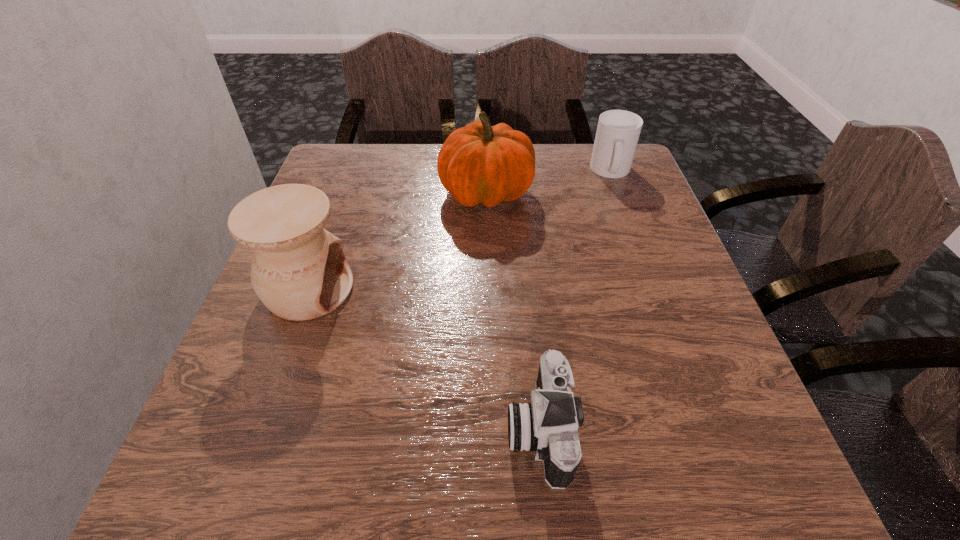
Identify the location of free region located on the back of the shortest object. (527, 305).

The image size is (960, 540). Find the location of `pumpkin that is at the far edge`. pumpkin that is at the far edge is located at coordinates (479, 163).

Locate an element on the screen. mug at the far edge is located at coordinates (618, 131).

Identify the location of object that is at the near edge. (548, 425).

Find the location of a particular element. The image size is (960, 540). object located in the left edge section of the desktop is located at coordinates (299, 271).

Find the location of `object that is positioned at the right edge`. object that is positioned at the right edge is located at coordinates (618, 131).

Find the location of a particular element. This screenshot has width=960, height=540. object positioned at the far right corner is located at coordinates (618, 131).

This screenshot has height=540, width=960. Find the location of `vacant space at the far edge of the desktop`. vacant space at the far edge of the desktop is located at coordinates (547, 179).

Image resolution: width=960 pixels, height=540 pixels. In the image, there is a desktop. What are the coordinates of `vacant space at the left edge` in the screenshot? It's located at (355, 219).

Locate an element on the screen. The image size is (960, 540). vacant space at the right edge of the desktop is located at coordinates coord(729,438).